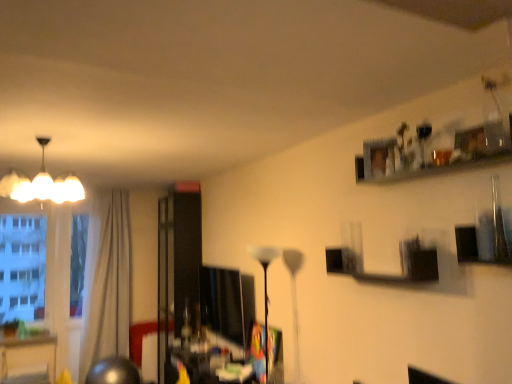
Question: Is white glossy floor lamp at center, which ranks as the 2th lamp in left-to-right order, positioned with its back to beige fabric curtain at left?

Choices:
 (A) no
 (B) yes

Answer: (A)

Question: Is white glossy floor lamp at center, placed as the 1th lamp when sorted from right to left, thinner than beige fabric curtain at left?

Choices:
 (A) yes
 (B) no

Answer: (A)

Question: Considering the relative sizes of white glossy floor lamp at center, which ranks as the first lamp in bottom-to-top order, and beige fabric curtain at left in the image provided, is white glossy floor lamp at center, which ranks as the first lamp in bottom-to-top order, wider than beige fabric curtain at left?

Choices:
 (A) yes
 (B) no

Answer: (B)

Question: From a real-world perspective, is white glossy floor lamp at center, acting as the 2th lamp starting from the top, located higher than beige fabric curtain at left?

Choices:
 (A) no
 (B) yes

Answer: (A)

Question: Is white glossy floor lamp at center, placed as the 1th lamp when sorted from right to left, in front of beige fabric curtain at left?

Choices:
 (A) yes
 (B) no

Answer: (A)

Question: Can you confirm if white glossy floor lamp at center, which ranks as the 2th lamp in left-to-right order, is positioned to the left of beige fabric curtain at left?

Choices:
 (A) yes
 (B) no

Answer: (B)

Question: Does white glossy chandelier at upper left, the second lamp ordered from the bottom, have a lesser width compared to white glossy floor lamp at center, which ranks as the first lamp in bottom-to-top order?

Choices:
 (A) yes
 (B) no

Answer: (B)

Question: From a real-world perspective, is white glossy chandelier at upper left, the 1th lamp in the left-to-right sequence, on top of white glossy floor lamp at center, placed as the 1th lamp when sorted from right to left?

Choices:
 (A) no
 (B) yes

Answer: (B)

Question: Is white glossy chandelier at upper left, the first lamp when ordered from top to bottom, closer to the viewer compared to white glossy floor lamp at center, which ranks as the 2th lamp in left-to-right order?

Choices:
 (A) no
 (B) yes

Answer: (B)

Question: Does white glossy chandelier at upper left, the second lamp from the right, appear on the left side of white glossy floor lamp at center, which ranks as the 2th lamp in left-to-right order?

Choices:
 (A) yes
 (B) no

Answer: (A)

Question: Is white glossy chandelier at upper left, the second lamp from the right, with white glossy floor lamp at center, acting as the 2th lamp starting from the top?

Choices:
 (A) yes
 (B) no

Answer: (B)

Question: Is white glossy chandelier at upper left, the second lamp ordered from the bottom, not near white glossy floor lamp at center, placed as the 1th lamp when sorted from right to left?

Choices:
 (A) yes
 (B) no

Answer: (A)

Question: From a real-world perspective, does white glossy chandelier at upper left, the second lamp ordered from the bottom, stand above matte black monitor at center?

Choices:
 (A) no
 (B) yes

Answer: (B)